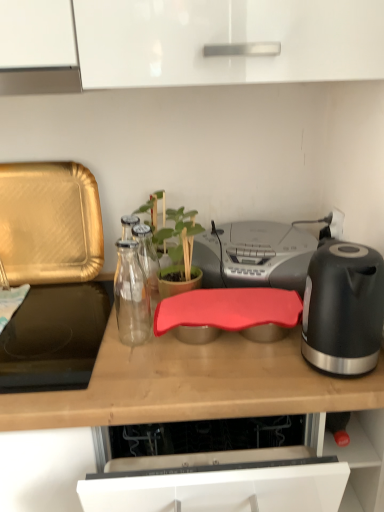
Question: In terms of width, does black matte electric kettle at right look wider or thinner when compared to green matte plant at center?

Choices:
 (A) thin
 (B) wide

Answer: (A)

Question: From a real-world perspective, is black matte electric kettle at right positioned above or below green matte plant at center?

Choices:
 (A) below
 (B) above

Answer: (B)

Question: Which object is positioned closest to the black glass cooktop at left?

Choices:
 (A) green matte plant at center
 (B) gray plastic stereo at center
 (C) gold textured tray at left
 (D) black matte electric kettle at right
 (E) rubberized red cutting board at center

Answer: (E)

Question: Based on their relative distances, which object is nearer to the green matte plant at center?

Choices:
 (A) gold textured tray at left
 (B) black matte electric kettle at right
 (C) metallic silver exhaust hood at upper left
 (D) gray plastic stereo at center
 (E) rubberized red cutting board at center

Answer: (D)